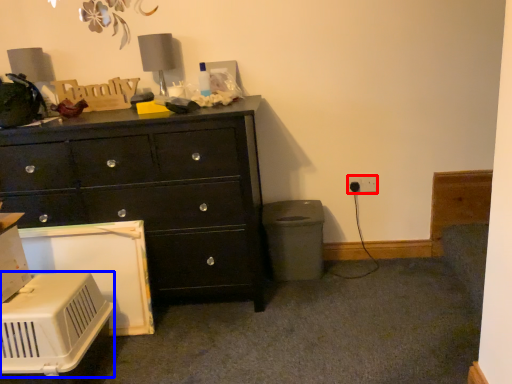
Question: Which point is further to the camera, electric outlet (highlighted by a red box) or appliance (highlighted by a blue box)?

Choices:
 (A) electric outlet
 (B) appliance

Answer: (A)